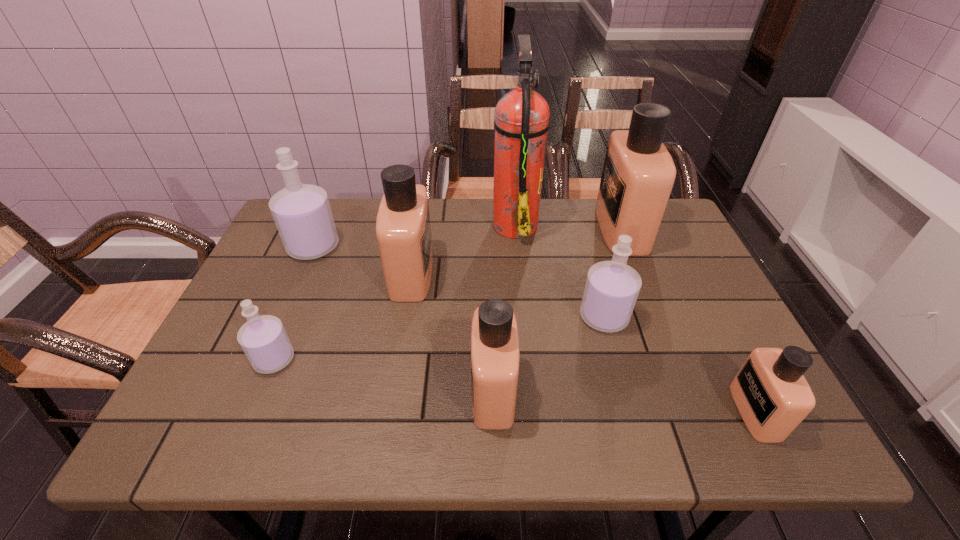
Find the location of a particular element. The image size is (960, 540). the smallest purple perfume is located at coordinates (263, 339).

Where is `the rightmost perfume`? This screenshot has height=540, width=960. the rightmost perfume is located at coordinates (773, 397).

Image resolution: width=960 pixels, height=540 pixels. Find the location of `the rightmost object`. the rightmost object is located at coordinates click(773, 397).

Locate an element on the screen. vacant area situated at the nozzle of the tallest object is located at coordinates (363, 224).

Identify the location of vacant area situated 0.090m at the nozzle of the tallest object. This screenshot has height=540, width=960. pos(462,224).

In order to click on vacant position located at the nozzle of the tallest object in this screenshot , I will do `click(366, 224)`.

You are a GUI agent. You are given a task and a screenshot of the screen. Output one action in this format:
    pyautogui.click(x=<x>, y=<y>)
    Task: Click on the vacant space situated 0.200m on the front label of the third beige perfume from left to right
    
    Given the screenshot: What is the action you would take?
    tap(532, 228)

Locate an element on the screen. The image size is (960, 540). vacant space situated 0.140m on the front label of the third beige perfume from left to right is located at coordinates (552, 228).

Identify the location of vacant area located on the front label of the third beige perfume from left to right. The width and height of the screenshot is (960, 540). (492, 228).

This screenshot has height=540, width=960. In order to click on free location located 0.060m on the front label of the second biggest beige perfume in this screenshot , I will do `click(455, 273)`.